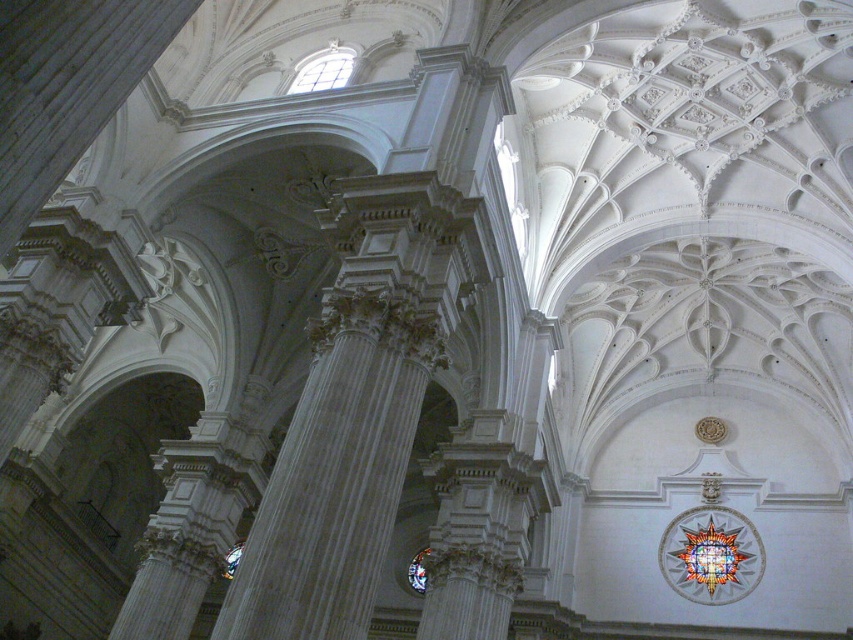
You are an architect designing a new cathedral and want to ensure proper lighting. Given the clear glass window at upper center and the stained glass window at center, which window allows more light into the cathedral?

The clear glass window at upper center allows more light into the cathedral because it is wider than the stained glass window at center.

You are standing inside the cathedral and want to look up at both the clear glass window at upper center and the stained glass window at center. Which window should you look at first to see the one that is higher?

You should look at the clear glass window at upper center first because it is positioned above the stained glass window at center.